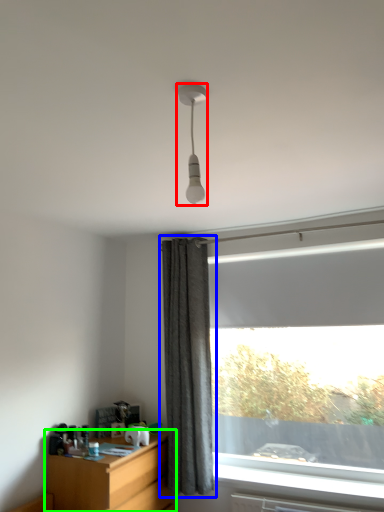
Question: Which is nearer to the lamp (highlighted by a red box)? curtain (highlighted by a blue box) or desk (highlighted by a green box).

Choices:
 (A) curtain
 (B) desk

Answer: (A)